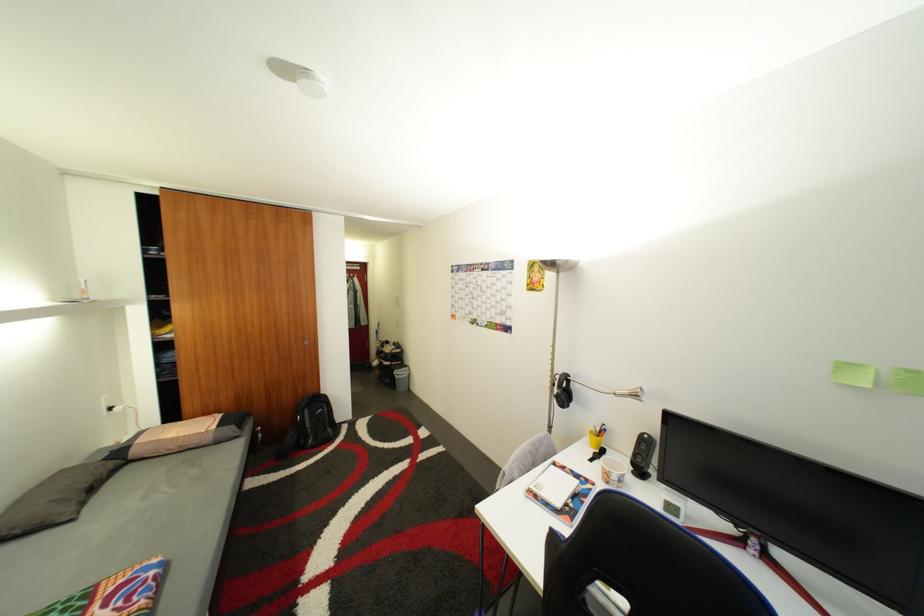
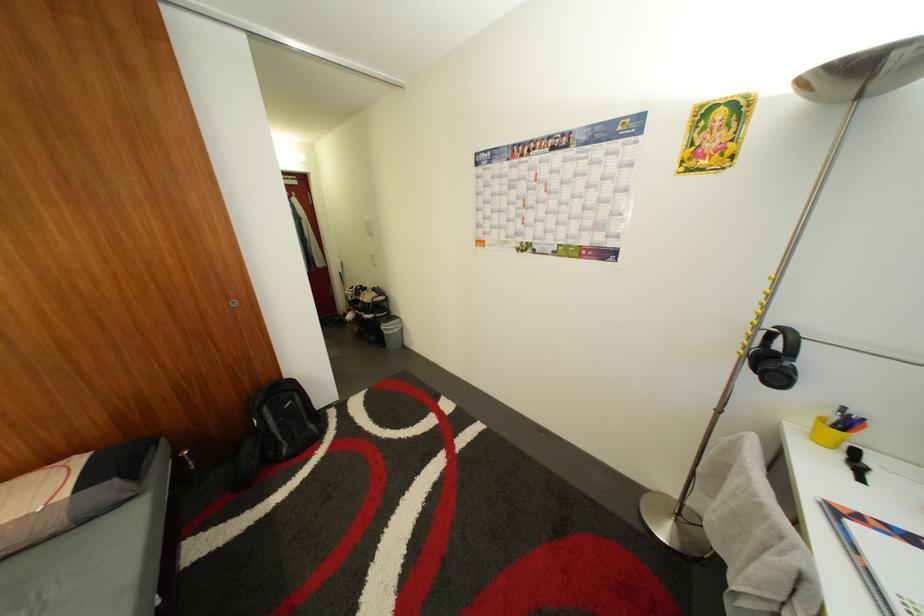
The images are taken continuously from a first-person perspective. In which direction are you moving?

The cameraman moved toward left, forward.